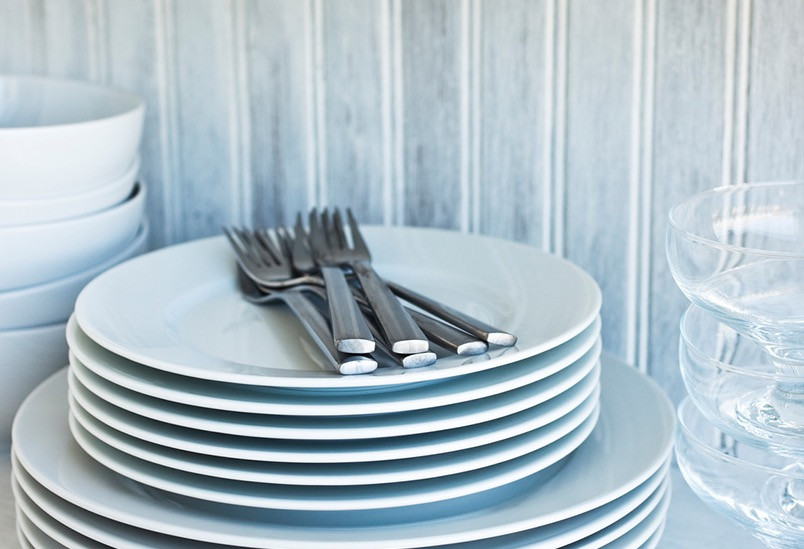
Find the location of `sides of bowls`. sides of bowls is located at coordinates (23, 358), (34, 307), (25, 253), (47, 173).